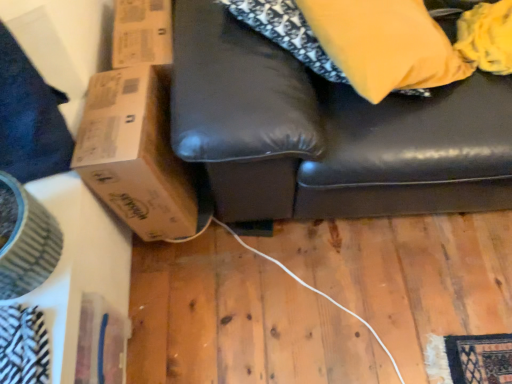
Question: Considering the relative positions of wooden floor at lower center and matte yellow pillow at upper right in the image provided, is wooden floor at lower center behind matte yellow pillow at upper right?

Choices:
 (A) no
 (B) yes

Answer: (B)

Question: From a real-world perspective, is wooden floor at lower center located beneath matte yellow pillow at upper right?

Choices:
 (A) no
 (B) yes

Answer: (B)

Question: Would you say wooden floor at lower center is a long distance from matte yellow pillow at upper right?

Choices:
 (A) no
 (B) yes

Answer: (A)

Question: Is wooden floor at lower center outside of matte yellow pillow at upper right?

Choices:
 (A) yes
 (B) no

Answer: (A)

Question: Is wooden floor at lower center bigger than matte yellow pillow at upper right?

Choices:
 (A) no
 (B) yes

Answer: (A)

Question: Is wooden floor at lower center directly adjacent to matte yellow pillow at upper right?

Choices:
 (A) yes
 (B) no

Answer: (B)

Question: Is matte yellow pillow at upper right at the left side of brown cardboard box at left?

Choices:
 (A) no
 (B) yes

Answer: (A)

Question: Can you confirm if matte yellow pillow at upper right is thinner than brown cardboard box at left?

Choices:
 (A) no
 (B) yes

Answer: (B)

Question: Is matte yellow pillow at upper right positioned beyond the bounds of brown cardboard box at left?

Choices:
 (A) no
 (B) yes

Answer: (B)

Question: Is matte yellow pillow at upper right shorter than brown cardboard box at left?

Choices:
 (A) yes
 (B) no

Answer: (A)

Question: Considering the relative sizes of matte yellow pillow at upper right and brown cardboard box at left in the image provided, is matte yellow pillow at upper right taller than brown cardboard box at left?

Choices:
 (A) no
 (B) yes

Answer: (A)

Question: Is matte yellow pillow at upper right oriented towards brown cardboard box at left?

Choices:
 (A) no
 (B) yes

Answer: (A)

Question: Is brown cardboard box at left to the right of matte yellow pillow at upper right from the viewer's perspective?

Choices:
 (A) no
 (B) yes

Answer: (A)